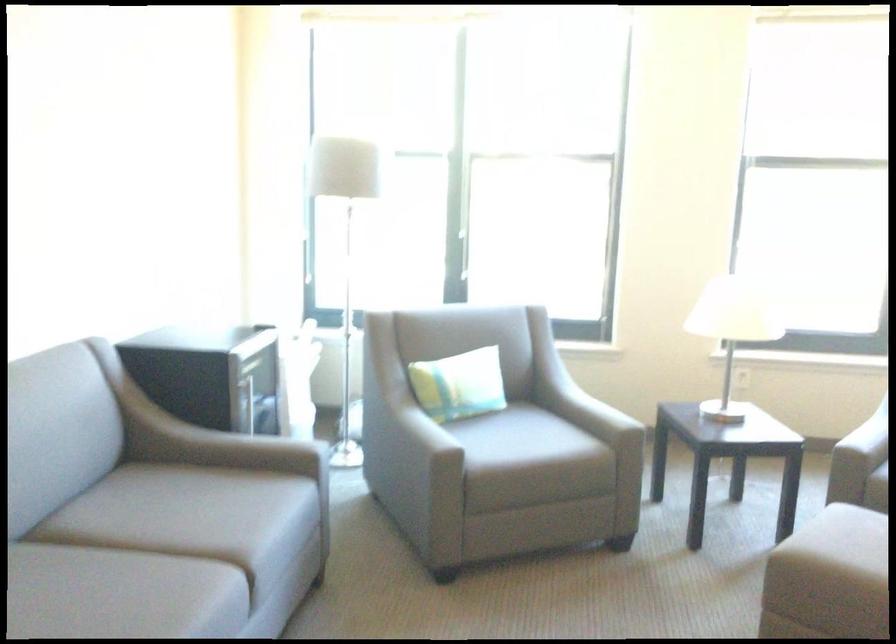
Where is `sofa sitting surface`? The height and width of the screenshot is (644, 896). sofa sitting surface is located at coordinates (495, 431).